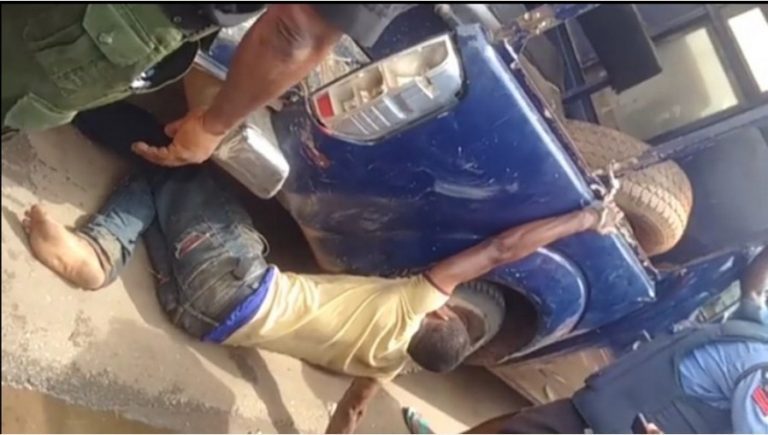
The height and width of the screenshot is (435, 768). Find the location of `lights`. lights is located at coordinates pos(414,70).